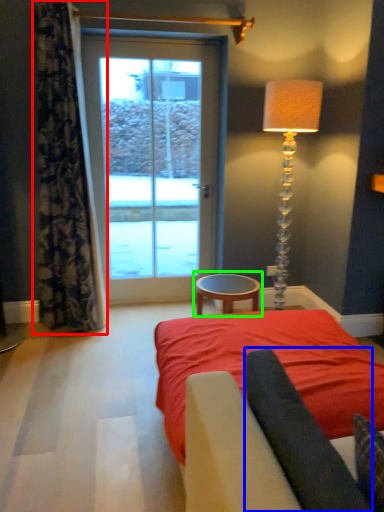
Question: Which object is positioned closest to curtain (highlighted by a red box)? Select from dark (highlighted by a blue box) and table (highlighted by a green box).

Choices:
 (A) dark
 (B) table

Answer: (B)